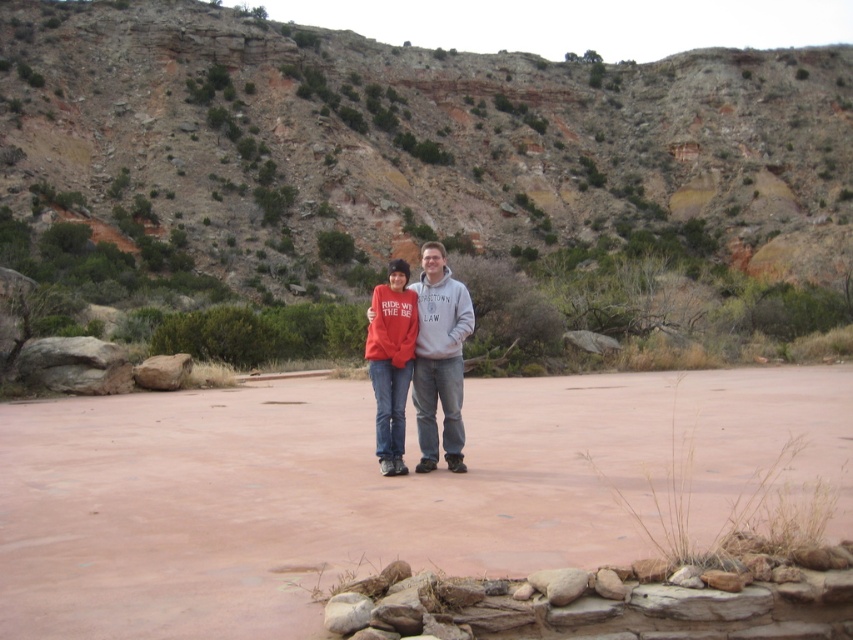
You are an observer in the desert scene. There are two people wearing red clothing items at center. Which clothing item is positioned lower between the matte red hoodie at center and the matte red sweatshirt at center?

The matte red hoodie at center is located below the matte red sweatshirt at center, so it is positioned lower.

You are a photographer trying to capture both the matte red hoodie at center and the matte red sweatshirt at center in the same frame. Since they are both red, how can you distinguish them in the photo?

The matte red hoodie at center is taller than the matte red sweatshirt at center, so you can distinguish them by their height difference.